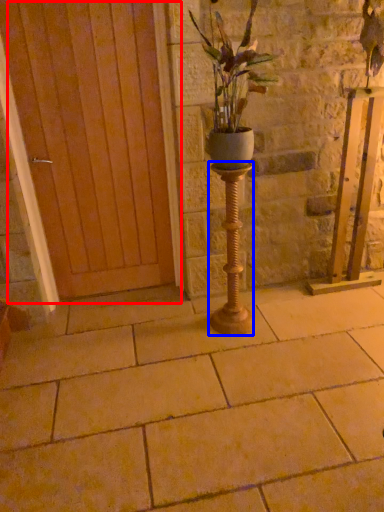
Question: Among these objects, which one is nearest to the camera, door (highlighted by a red box) or candle holder (highlighted by a blue box)?

Choices:
 (A) door
 (B) candle holder

Answer: (B)